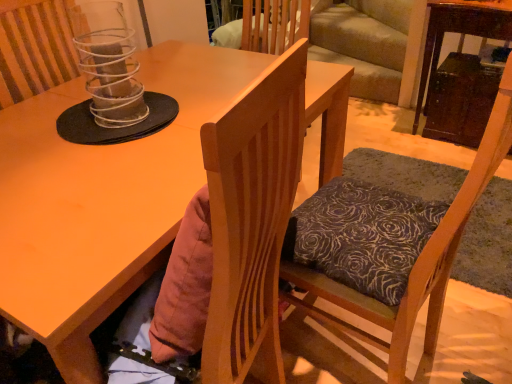
Question: Considering the positions of wooden chair with patterned cushion at center and matte wood desk at center in the image, is wooden chair with patterned cushion at center taller or shorter than matte wood desk at center?

Choices:
 (A) tall
 (B) short

Answer: (A)

Question: Based on their sizes in the image, would you say wooden chair with patterned cushion at center is bigger or smaller than matte wood desk at center?

Choices:
 (A) big
 (B) small

Answer: (B)

Question: Which of these objects is positioned closest to the clear plastic spiral at upper center?

Choices:
 (A) wooden chair with patterned cushion at center
 (B) matte wood desk at center

Answer: (B)

Question: Estimate the real-world distances between objects in this image. Which object is closer to the wooden chair with patterned cushion at center?

Choices:
 (A) matte wood desk at center
 (B) clear plastic spiral at upper center

Answer: (A)